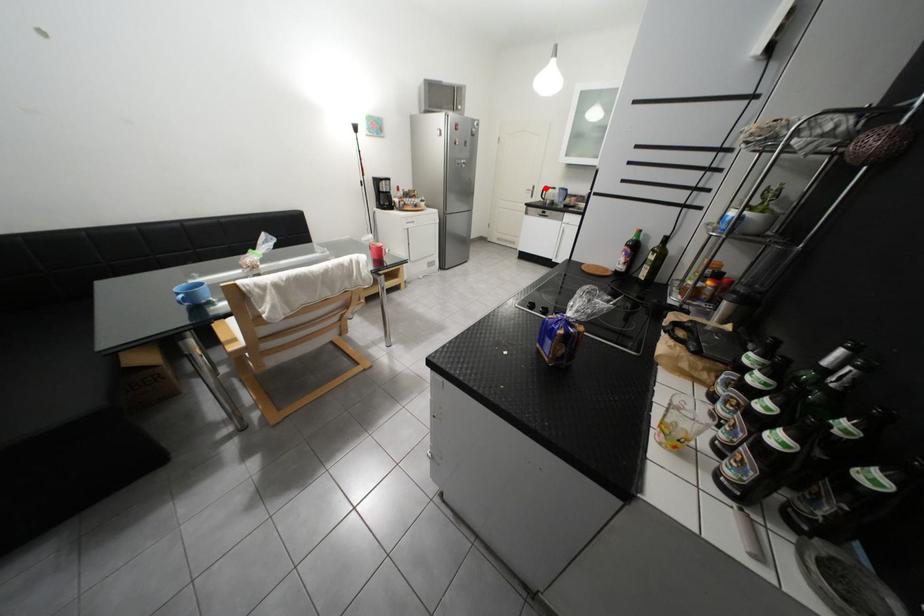
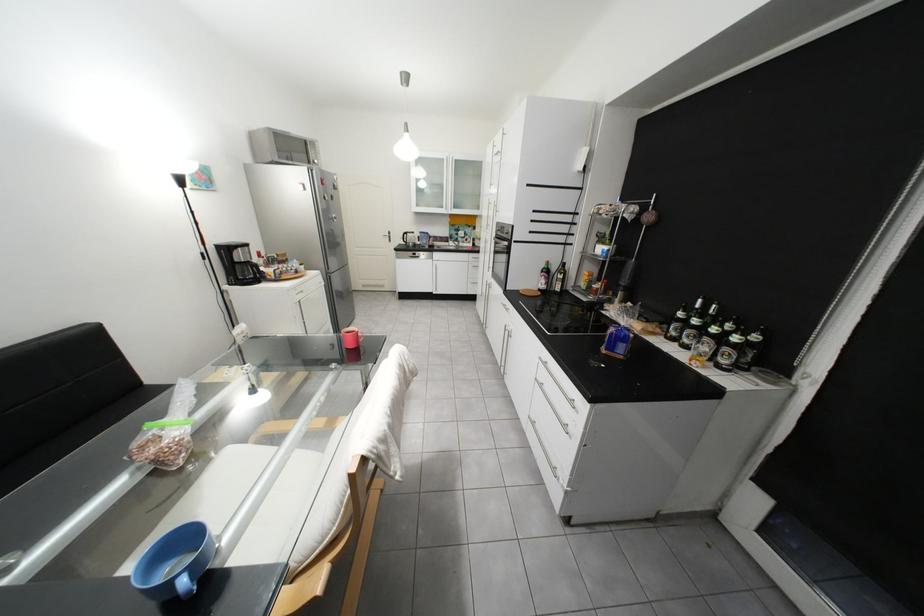
Where in the second image is the point corresponding to the highlighted location from the first image?

(402, 233)